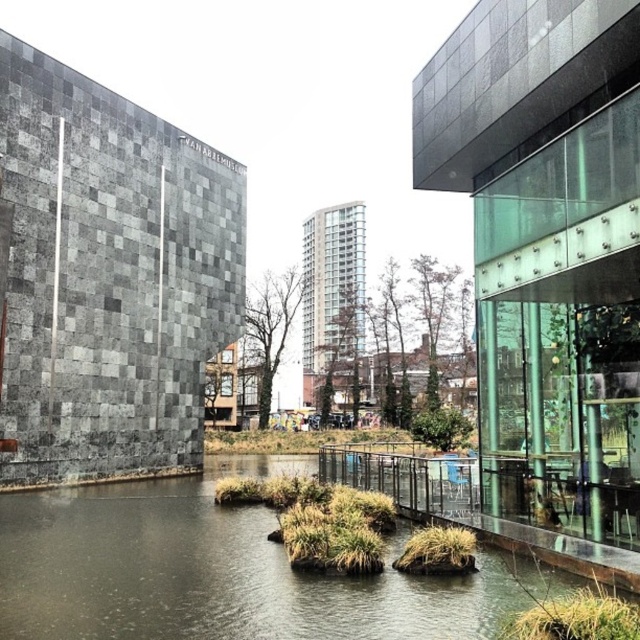
You are a landscape architect designing a new park. You want to place a small wooden bench on the larger area between the dark gray concrete river at center and the green grass at lower center. Which area should you choose for the bench?

The dark gray concrete river at center is larger in size than the green grass at lower center, so the bench should be placed on the dark gray concrete river at center.

You are a drone operator trying to capture aerial footage of the dark gray concrete river at center and the green grass at center. Which object should you fly closer to in order to ensure both are visible in the frame?

The dark gray concrete river at center has a greater height compared to the green grass at center, so you should fly closer to the green grass at center to ensure both are visible in the frame.